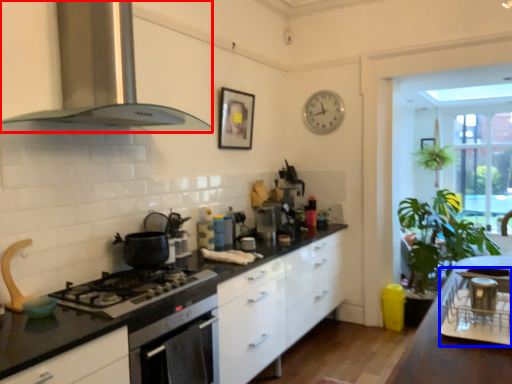
Question: Which object appears closest to the camera in this image, kitchen appliance (highlighted by a red box) or appliance (highlighted by a blue box)?

Choices:
 (A) kitchen appliance
 (B) appliance

Answer: (B)